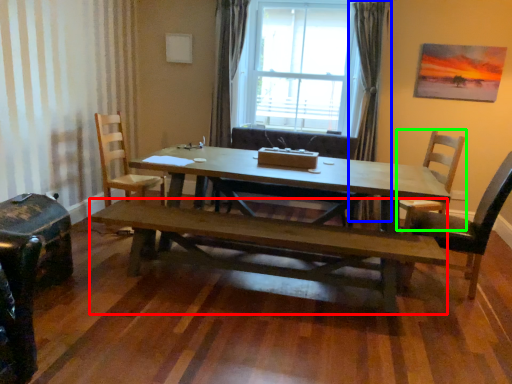
Question: Considering the real-world distances, which object is farthest from bench (highlighted by a red box)? curtain (highlighted by a blue box) or chair (highlighted by a green box)?

Choices:
 (A) curtain
 (B) chair

Answer: (A)